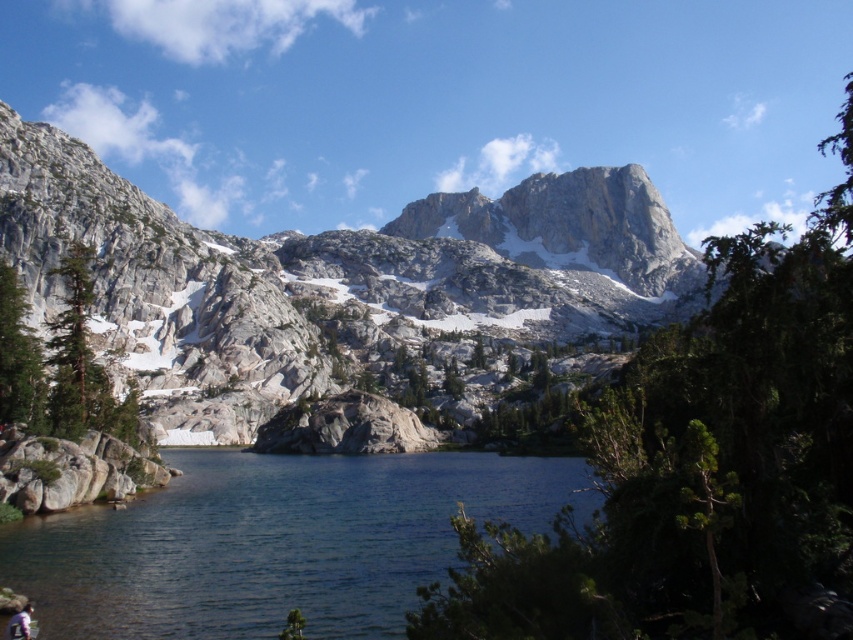
Question: Which point appears farthest from the camera in this image?

Choices:
 (A) (416, 316)
 (B) (250, 506)

Answer: (A)

Question: Which point appears closest to the camera in this image?

Choices:
 (A) (134, 620)
 (B) (569, 236)

Answer: (A)

Question: Can you confirm if white rocky mountain at center is wider than clear water at center?

Choices:
 (A) yes
 (B) no

Answer: (A)

Question: Which point appears closest to the camera in this image?

Choices:
 (A) (227, 266)
 (B) (317, 584)

Answer: (B)

Question: Where is white rocky mountain at center located in relation to clear water at center in the image?

Choices:
 (A) below
 (B) above

Answer: (B)

Question: Can you confirm if white rocky mountain at center is positioned above clear water at center?

Choices:
 (A) yes
 (B) no

Answer: (A)